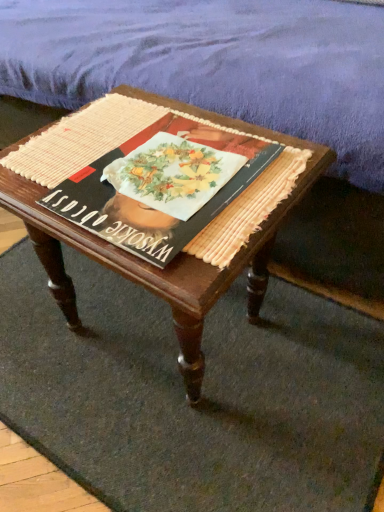
Question: Is purple fabric mattress at upper center completely or partially inside wooden coffee table at center?

Choices:
 (A) yes
 (B) no

Answer: (B)

Question: From the image's perspective, would you say wooden coffee table at center is positioned over purple fabric mattress at upper center?

Choices:
 (A) no
 (B) yes

Answer: (A)

Question: Is wooden coffee table at center shorter than purple fabric mattress at upper center?

Choices:
 (A) no
 (B) yes

Answer: (B)

Question: From a real-world perspective, is wooden coffee table at center over purple fabric mattress at upper center?

Choices:
 (A) no
 (B) yes

Answer: (A)

Question: Considering the relative sizes of wooden coffee table at center and purple fabric mattress at upper center in the image provided, is wooden coffee table at center wider than purple fabric mattress at upper center?

Choices:
 (A) yes
 (B) no

Answer: (B)

Question: Do you think woven beige doormat at center is within matte black book at center, or outside of it?

Choices:
 (A) outside
 (B) inside

Answer: (A)

Question: Based on their sizes in the image, would you say woven beige doormat at center is bigger or smaller than matte black book at center?

Choices:
 (A) big
 (B) small

Answer: (A)

Question: In terms of width, does woven beige doormat at center look wider or thinner when compared to matte black book at center?

Choices:
 (A) thin
 (B) wide

Answer: (B)

Question: Is woven beige doormat at center to the left or to the right of matte black book at center in the image?

Choices:
 (A) right
 (B) left

Answer: (B)

Question: Does point (382, 45) appear closer or farther from the camera than point (41, 189)?

Choices:
 (A) closer
 (B) farther

Answer: (B)

Question: Considering the relative positions of purple fabric mattress at upper center and wooden coffee table at center in the image provided, is purple fabric mattress at upper center to the left or to the right of wooden coffee table at center?

Choices:
 (A) left
 (B) right

Answer: (A)

Question: From the image's perspective, is purple fabric mattress at upper center positioned above or below wooden coffee table at center?

Choices:
 (A) above
 (B) below

Answer: (A)

Question: Is purple fabric mattress at upper center inside the boundaries of wooden coffee table at center, or outside?

Choices:
 (A) outside
 (B) inside

Answer: (A)

Question: Based on their positions, is woven beige doormat at center located to the left or right of purple fabric mattress at upper center?

Choices:
 (A) right
 (B) left

Answer: (B)

Question: Considering the positions of woven beige doormat at center and purple fabric mattress at upper center in the image, is woven beige doormat at center taller or shorter than purple fabric mattress at upper center?

Choices:
 (A) short
 (B) tall

Answer: (A)